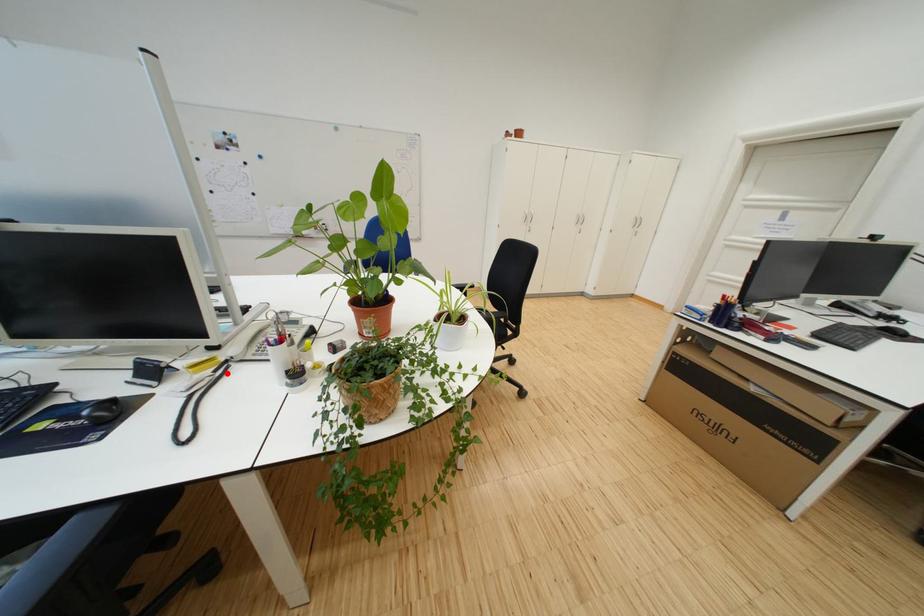
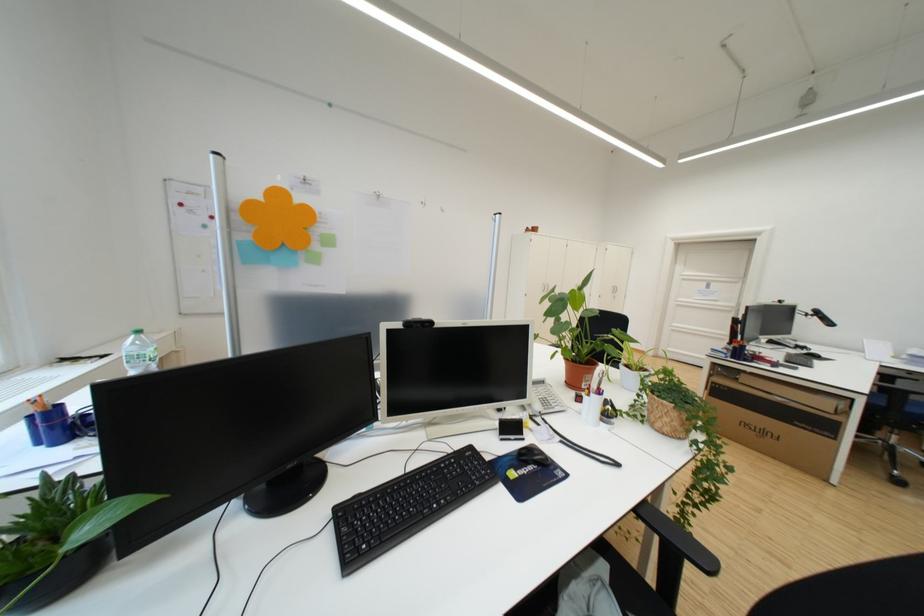
Question: I am providing you with two images of the same scene from different viewpoints. A red point is marked on the first image. Can you still see the location of the red point in image 2?

Choices:
 (A) Yes
 (B) No

Answer: (A)